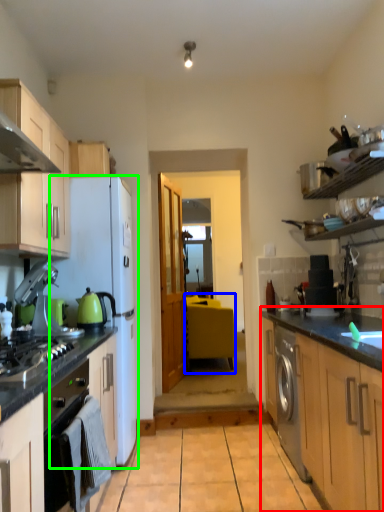
Question: Considering the real-world distances, which object is farthest from counter (highlighted by a red box)? table (highlighted by a blue box) or refrigerator (highlighted by a green box)?

Choices:
 (A) table
 (B) refrigerator

Answer: (A)